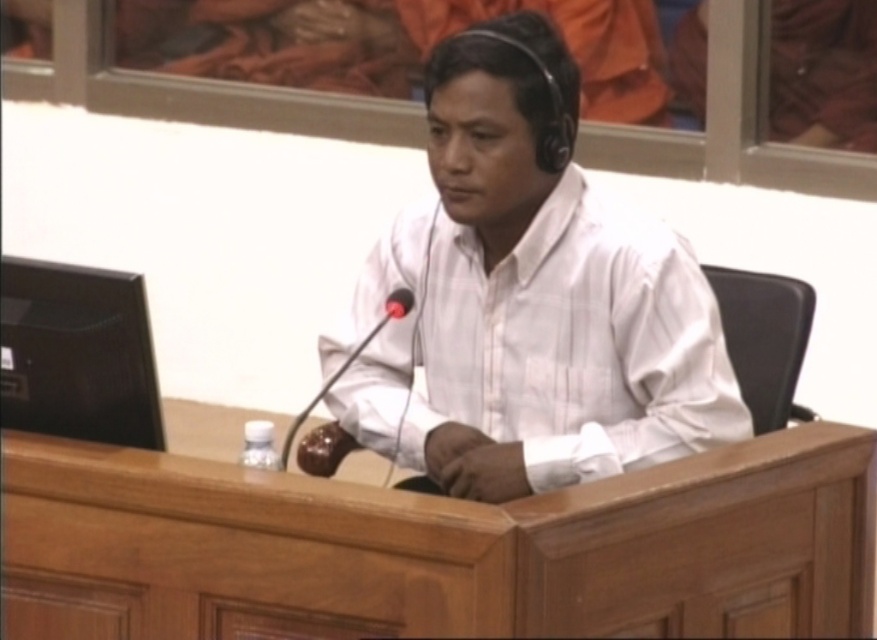
You are a photographer setting up for a formal event. You have a wooden table at center and a brown leather microphone at center in your frame. Which object should you adjust your camera focus to first if you want to ensure both are in focus, considering their sizes?

The wooden table at center is much taller than the brown leather microphone at center, so you should focus on the wooden table at center first to ensure depth of field covers both objects.

You are an architect designing a new courtroom layout and need to place a new monitor between the two points, point(453, 241) and point(324, 388). Which point should the monitor be closer to in order to be closer to the viewer?

The monitor should be closer to point(453, 241) because it is further to the viewer than point(324, 388).